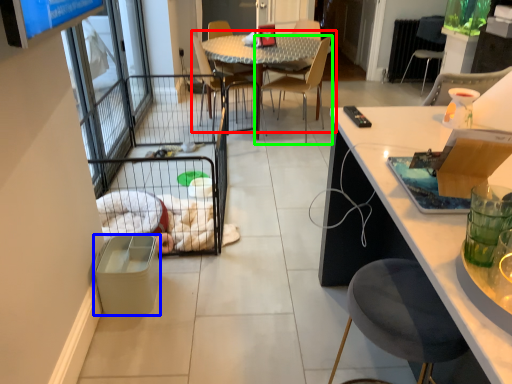
Question: Which is nearer to the kitchen & dining room table (highlighted by a red box)? trash bin/can (highlighted by a blue box) or chair (highlighted by a green box).

Choices:
 (A) trash bin/can
 (B) chair

Answer: (B)